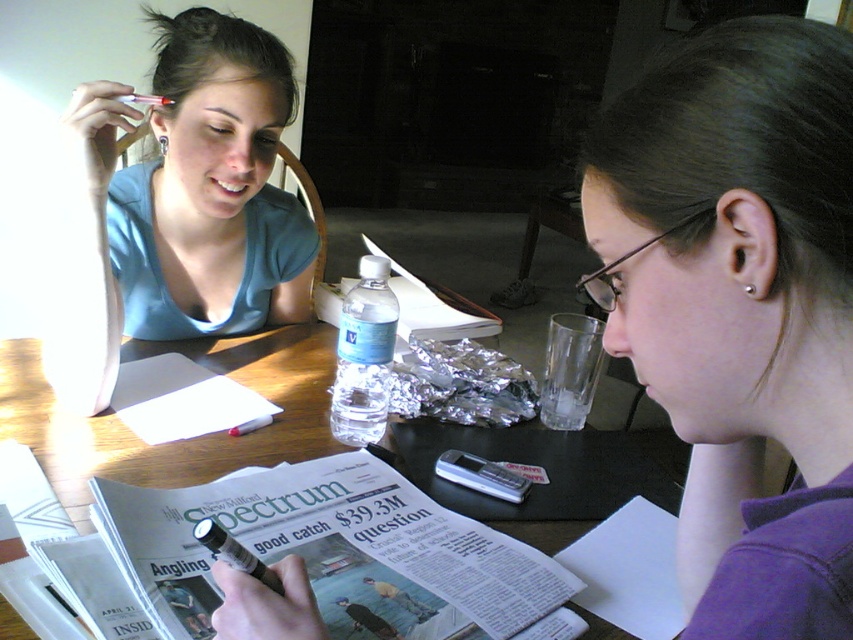
You are standing in front of the table where the two people are sitting. If you want to hand a document to the person wearing the purple fabric shirt at lower right, which direction should you move relative to the table?

Since the purple fabric shirt at lower right is located at coordinates approximately 0.481 on the x and 0.869 on the y, you should move towards the lower right direction relative to the table to reach them.

Where is the purple fabric shirt at lower right located in the image?

The purple fabric shirt at lower right is located at point 0.481 on the x axis and 0.869 on the y axis.